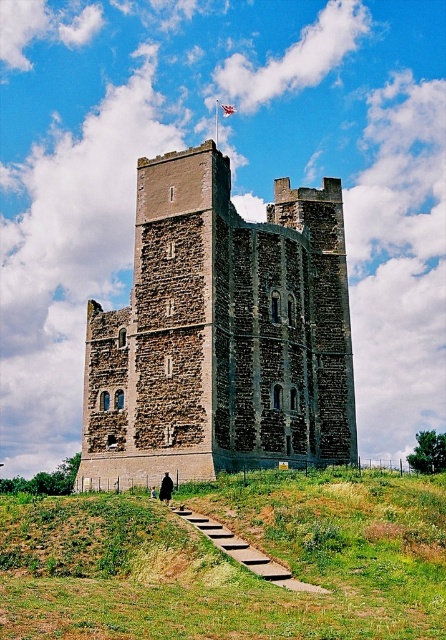
Question: Which of these objects is positioned closest to the wooden steps at lower center?

Choices:
 (A) white fabric flag at upper center
 (B) green grassy at lower center

Answer: (B)

Question: Among these objects, which one is nearest to the camera?

Choices:
 (A) wooden steps at lower center
 (B) white fabric flag at upper center
 (C) brown stone tower at center

Answer: (A)

Question: Is brown stone tower at center positioned at the back of wooden steps at lower center?

Choices:
 (A) yes
 (B) no

Answer: (A)

Question: Can you confirm if brown stone tower at center is smaller than wooden steps at lower center?

Choices:
 (A) no
 (B) yes

Answer: (A)

Question: Does brown stone tower at center have a larger size compared to white fabric flag at upper center?

Choices:
 (A) yes
 (B) no

Answer: (A)

Question: Based on their relative distances, which object is nearer to the brown stone tower at center?

Choices:
 (A) green grassy at lower center
 (B) white fabric flag at upper center
 (C) wooden steps at lower center

Answer: (A)